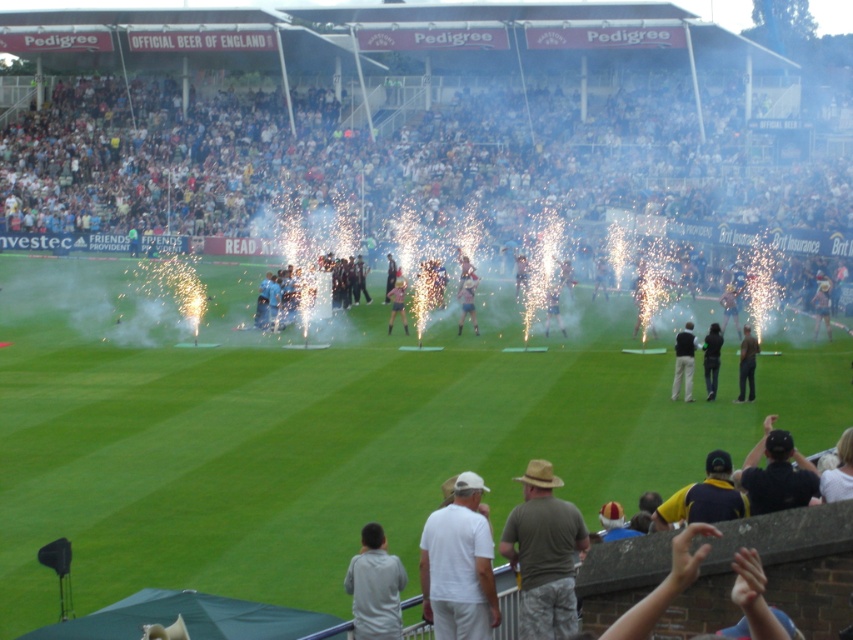
Consider the image. You are a photographer at the stadium event. You need to capture a photo of the light blue fabric at center and light brown fabric pants at center. Which fabric will appear taller in the photo?

The light blue fabric at center will appear taller in the photo because it has a greater height compared to the light brown fabric pants at center.

You are a photographer at the stadium and want to capture both the white cotton crowd at upper center and the gray matte jacket at lower center in a single shot. Which object will appear larger in the photo?

The white cotton crowd at upper center will appear larger in the photo because it is much taller than the gray matte jacket at lower center.